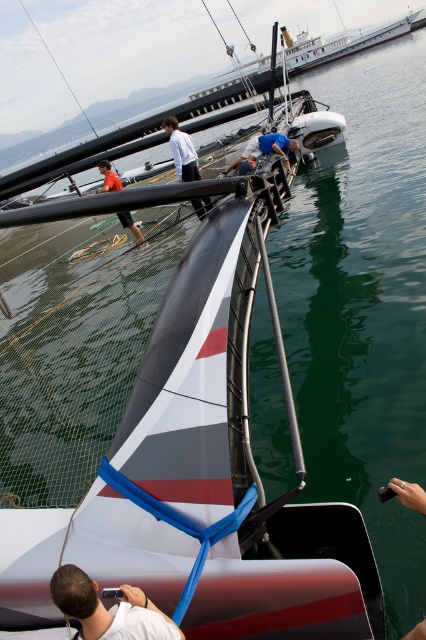
Question: Which of the following is the closest to the observer?

Choices:
 (A) orange fabric shorts at lower left
 (B) blue fabric shirt at center

Answer: (B)

Question: Which point is farther to the camera?

Choices:
 (A) blue fabric shirt at center
 (B) orange fabric shorts at lower left
 (C) white matte shirt at center

Answer: (B)

Question: Observing the image, what is the correct spatial positioning of white matte shirt at center in reference to blue fabric shirt at center?

Choices:
 (A) left
 (B) right

Answer: (A)

Question: Does white matte camera at lower left have a greater width compared to blue fabric shirt at center?

Choices:
 (A) yes
 (B) no

Answer: (B)

Question: Where is white matte shirt at center located in relation to orange fabric shorts at lower left in the image?

Choices:
 (A) above
 (B) below

Answer: (A)

Question: Estimate the real-world distances between objects in this image. Which object is farther from the blue fabric shirt at center?

Choices:
 (A) white matte camera at lower left
 (B) white matte shirt at center

Answer: (A)